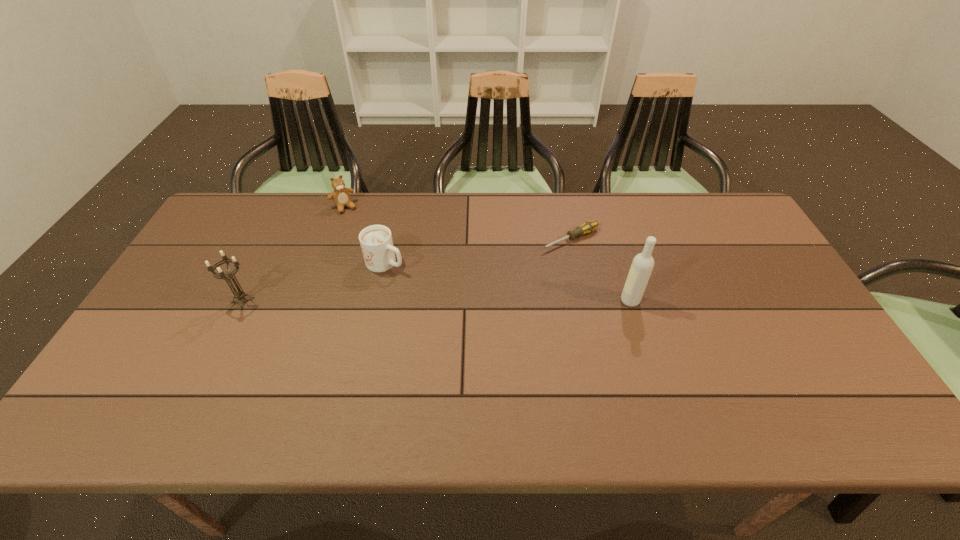
At what (x,y) coordinates should I click in order to perform the action: click on the fourth shortest object. Please return your answer as a coordinate pair (x, y). The height and width of the screenshot is (540, 960). Looking at the image, I should click on (240, 294).

You are a GUI agent. You are given a task and a screenshot of the screen. Output one action in this format:
    pyautogui.click(x=<x>, y=<y>)
    Task: Click on the leftmost object
    This screenshot has height=540, width=960.
    Given the screenshot: What is the action you would take?
    click(x=240, y=294)

Locate an element on the screen. the rightmost object is located at coordinates (643, 263).

Locate an element on the screen. This screenshot has width=960, height=540. the tallest object is located at coordinates (643, 263).

Find the location of a particular element. The image size is (960, 540). screwdriver is located at coordinates (587, 227).

At what (x,y) coordinates should I click in order to perform the action: click on the second object from right to left. Please return your answer as a coordinate pair (x, y). Looking at the image, I should click on (587, 227).

Where is `cappuccino`? cappuccino is located at coordinates (376, 242).

The image size is (960, 540). Identify the location of the fourth object from right to left. (341, 195).

Identify the location of the farthest object. (341, 195).

You are a GUI agent. You are given a task and a screenshot of the screen. Output one action in this format:
    pyautogui.click(x=<x>, y=<y>)
    Task: Click on the vacant space situated 0.230m on the right of the candle holder
    The width and height of the screenshot is (960, 540).
    Given the screenshot: What is the action you would take?
    pyautogui.click(x=341, y=300)